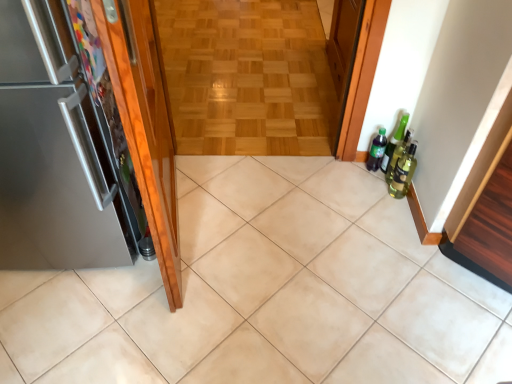
You are a GUI agent. You are given a task and a screenshot of the screen. Output one action in this format:
    pyautogui.click(x=<x>, y=<y>)
    Task: Click on the vacant space situated on the left part of green matte bottle at right
    
    Given the screenshot: What is the action you would take?
    pyautogui.click(x=341, y=173)